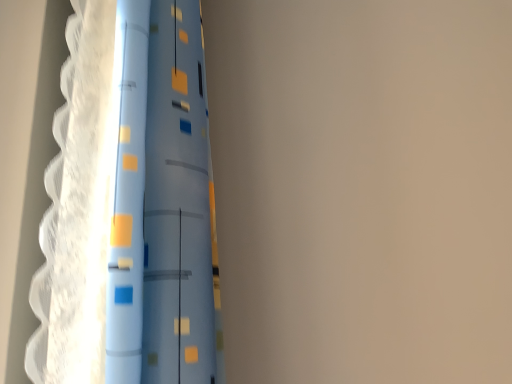
The image size is (512, 384). Find the location of `light blue fabric at upper left`. light blue fabric at upper left is located at coordinates click(x=130, y=205).

What do you see at coordinates (130, 205) in the screenshot? The image size is (512, 384). I see `light blue fabric at upper left` at bounding box center [130, 205].

At what (x,y) coordinates should I click in order to perform the action: click on light blue fabric at upper left. Please return your answer as a coordinate pair (x, y). Image resolution: width=512 pixels, height=384 pixels. Looking at the image, I should click on (130, 205).